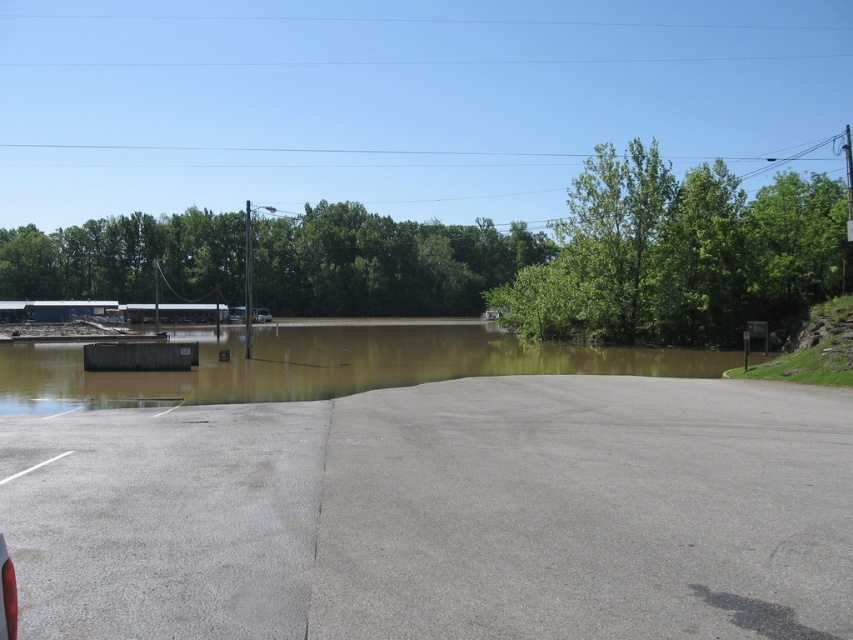
Does gray asphalt parking lot at center have a larger size compared to silver metallic car at center?

No.

The image size is (853, 640). What do you see at coordinates (444, 515) in the screenshot? I see `gray asphalt parking lot at center` at bounding box center [444, 515].

The width and height of the screenshot is (853, 640). I want to click on gray asphalt parking lot at center, so click(x=444, y=515).

Based on the photo, does gray asphalt parking lot at center have a smaller size compared to brown murky water at lower left?

Yes.

Which is behind, point (763, 518) or point (432, 336)?

Positioned behind is point (432, 336).

The height and width of the screenshot is (640, 853). Identify the location of gray asphalt parking lot at center. (444, 515).

Does brown murky water at lower left have a greater width compared to silver metallic car at center?

Yes, brown murky water at lower left is wider than silver metallic car at center.

Can you confirm if brown murky water at lower left is thinner than silver metallic car at center?

Incorrect, brown murky water at lower left's width is not less than silver metallic car at center's.

Identify the location of brown murky water at lower left. This screenshot has height=640, width=853. (323, 365).